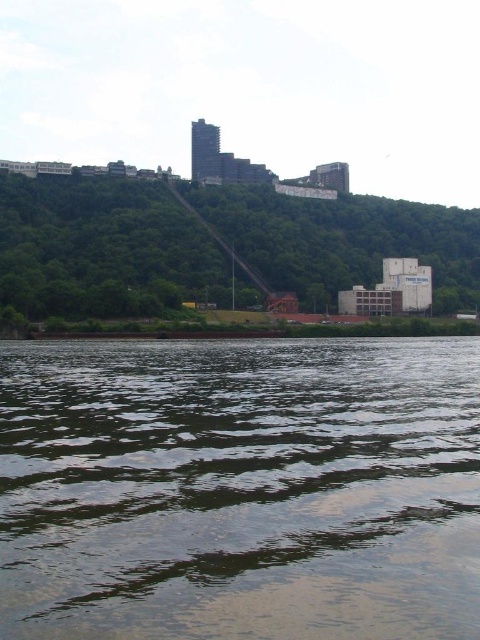
You are standing on the riverbank and notice the greenish reflective water at lower center and the green leafy hillside at upper center. Which of these two features takes up more area in the scene?

The green leafy hillside at upper center occupies more space than the greenish reflective water at lower center.

You are standing at the riverbank and see the greenish reflective water at lower center and the green leafy hillside at upper center. Which object is positioned to the left when looking at them from your current viewpoint?

The greenish reflective water at lower center is positioned to the left of the green leafy hillside at upper center.